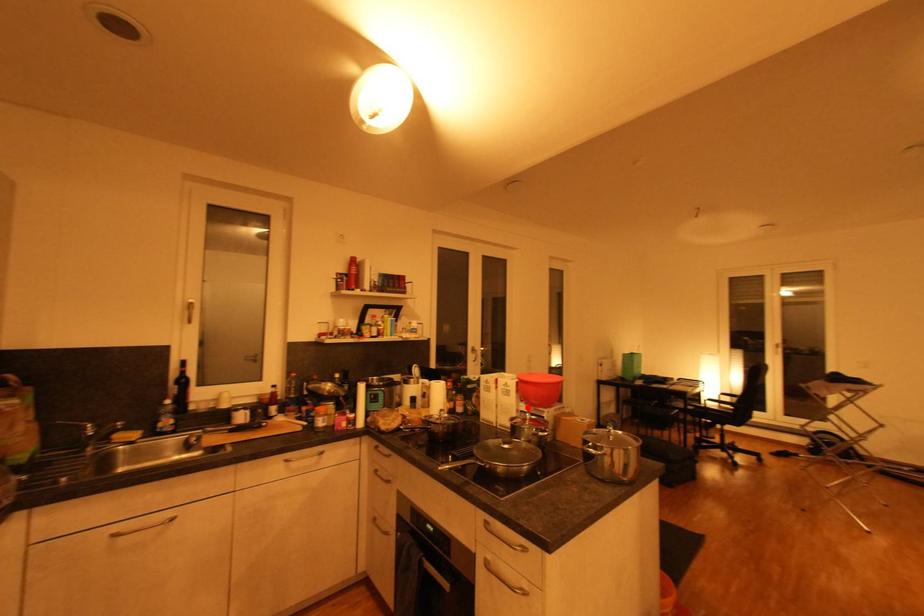
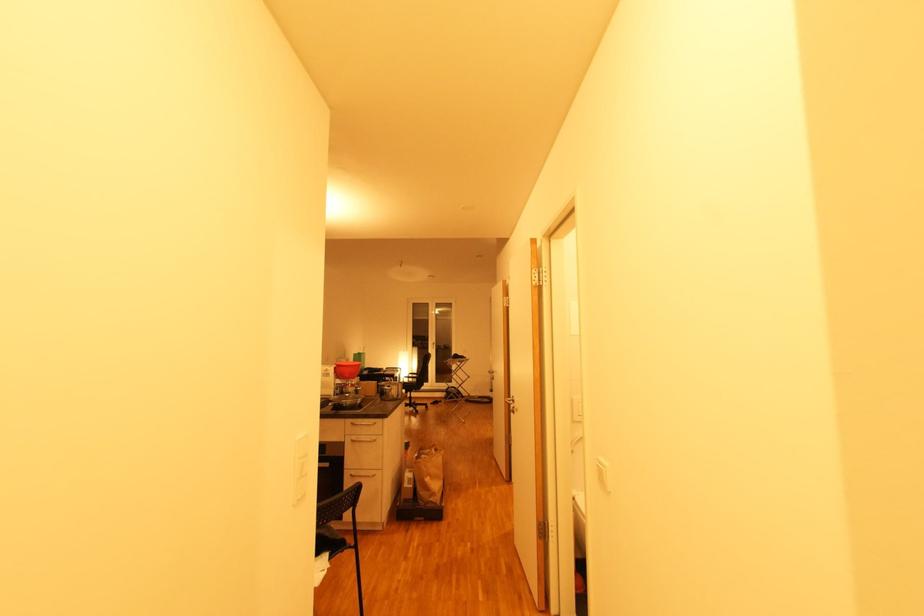
Question: I am providing you with two images of the same scene from different viewpoints. In image1, a red point is highlighted. Considering the same 3D point in image2, which of the following is correct?

Choices:
 (A) It is closer
 (B) It is farther

Answer: (A)